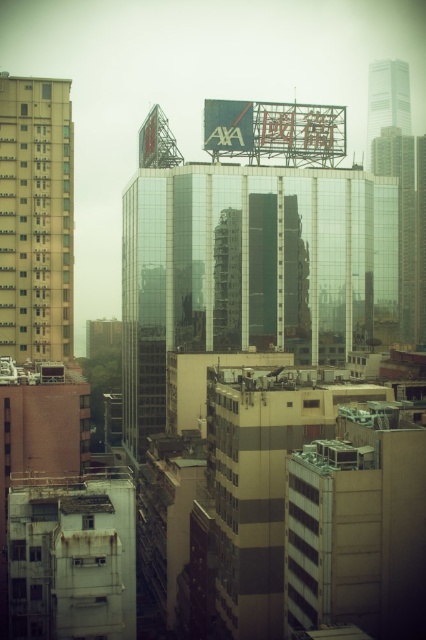
You are a city planner reviewing a map of the urban area shown. You need to determine the spatial relationship between the beige concrete building at left and the transparent glass skyscraper at center. Which building is positioned to the east of the other?

The beige concrete building at left is to the left of the transparent glass skyscraper at center. Since the image is viewed from an elevated vantage point, the left side of the image corresponds to the east direction. Therefore, the beige concrete building at left is positioned to the east of the transparent glass skyscraper at center.

You are a city planner assessing the potential for a new communication tower between the transparent glass skyscraper at center and the glass skyscraper at upper right. The tower requires a minimum of 40 meters of space between existing buildings to ensure structural safety. Based on the image, is the current distance sufficient for this requirement?

The distance between the transparent glass skyscraper at center and the glass skyscraper at upper right is 35.86 meters, which is less than the required 40 meters. Therefore, the current distance is insufficient for the new communication tower.

You are a city planner evaluating the urban layout. You need to determine if the beige concrete building at left can be expanded to match the width of the transparent glass skyscraper at center. Based on the current spatial arrangement, is this expansion feasible without encroaching on neighboring structures?

The beige concrete building at left has a lesser width compared to the transparent glass skyscraper at center. Therefore, expanding the beige concrete building at left to match the width of the transparent glass skyscraper at center would require additional space, but the description does not provide information about neighboring structures. Without knowing if there is available space or potential encroachment, it is uncertain if the expansion is feasible.